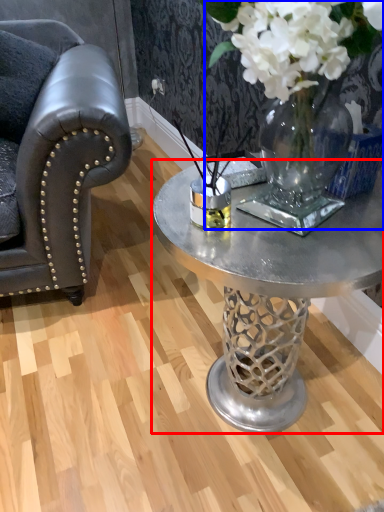
Question: Among these objects, which one is farthest to the camera, coffee table (highlighted by a red box) or floral arrangement (highlighted by a blue box)?

Choices:
 (A) coffee table
 (B) floral arrangement

Answer: (A)